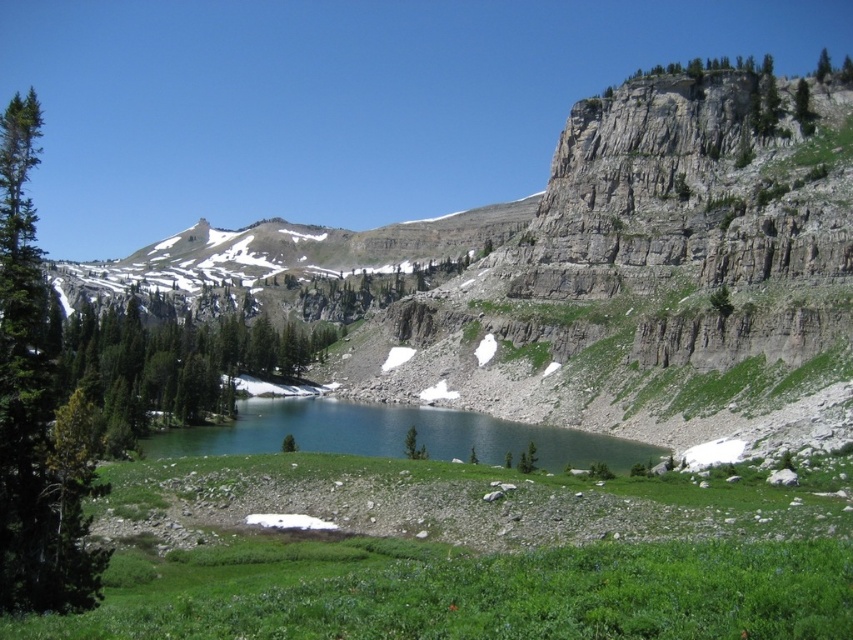
You are planning to set up a small tent in the scene. The tent requires a space wider than the green textured tree at upper right. Can the green grassy mountain lake at center provide enough width for the tent? Please explain based on the scene description.

The green grassy mountain lake at center has a width less than the green textured tree at upper right. Therefore, the lake is narrower than the required space for the tent, so it cannot accommodate the tent.

You are a hiker standing at the base of the green textured tree at left and want to reach the green leafy tree at center. Which direction should you move to get there?

The green textured tree at left is located above the green leafy tree at center, so you should move downward to reach the green leafy tree at center.